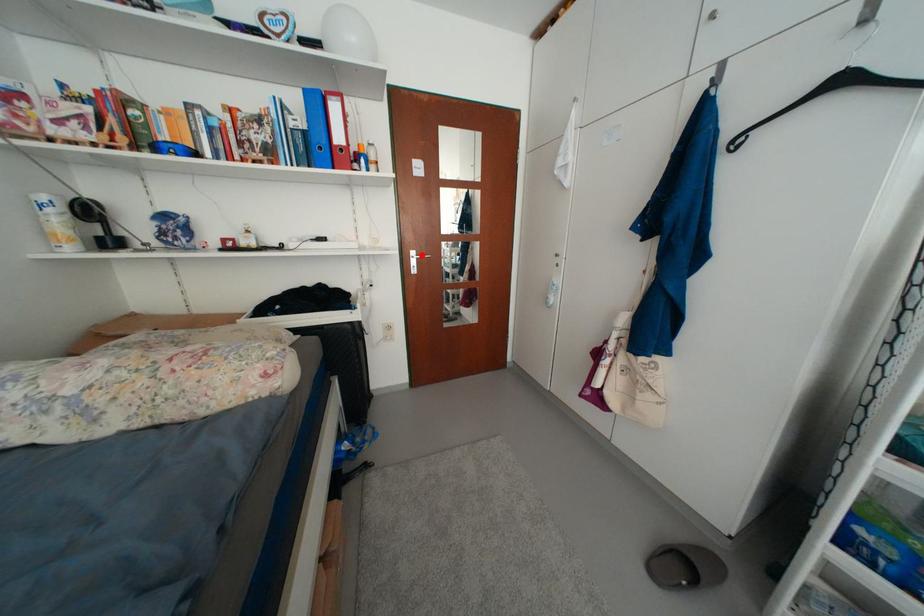
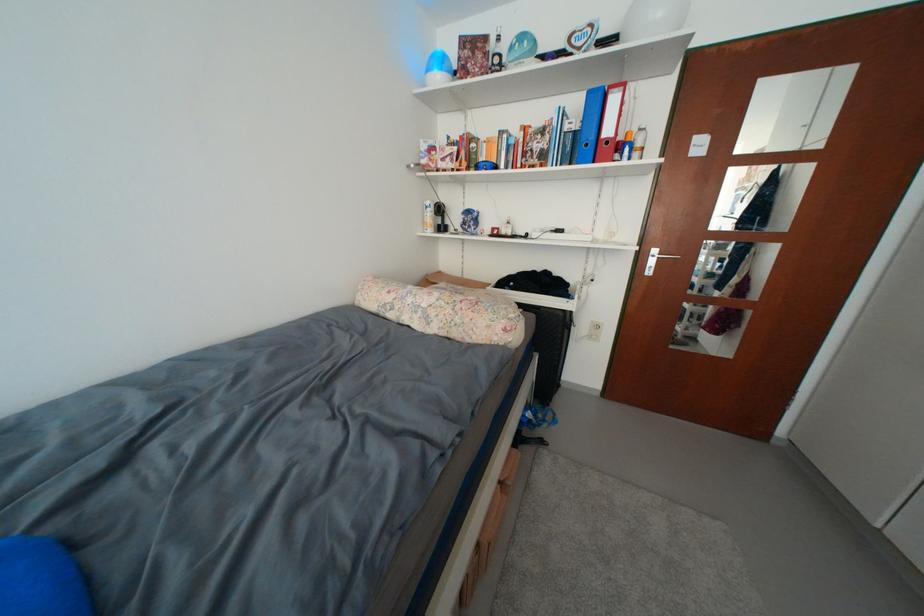
The point at the highlighted location is marked in the first image. Where is the corresponding point in the second image?

(663, 254)